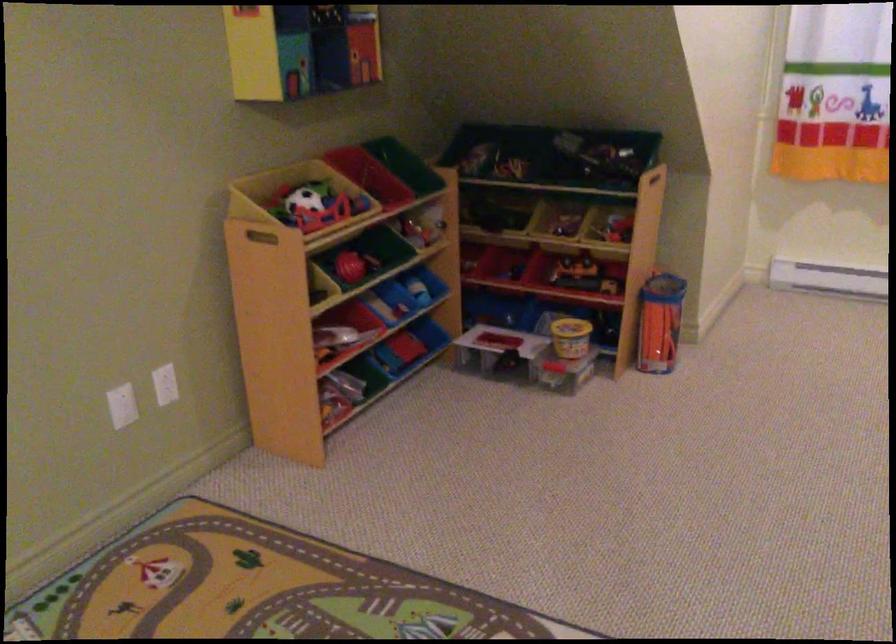
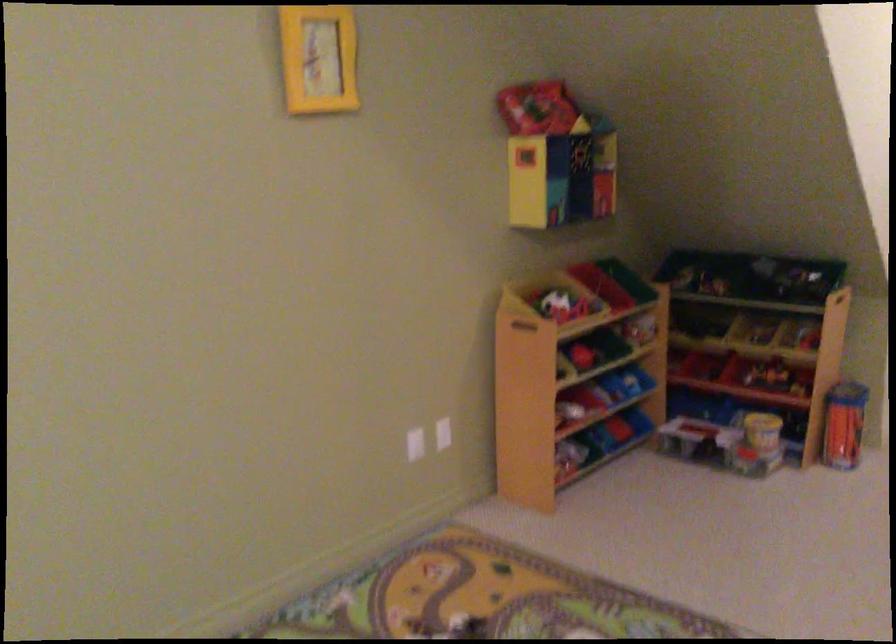
In the second image, find the point that corresponds to [343,335] in the first image.

(571, 410)